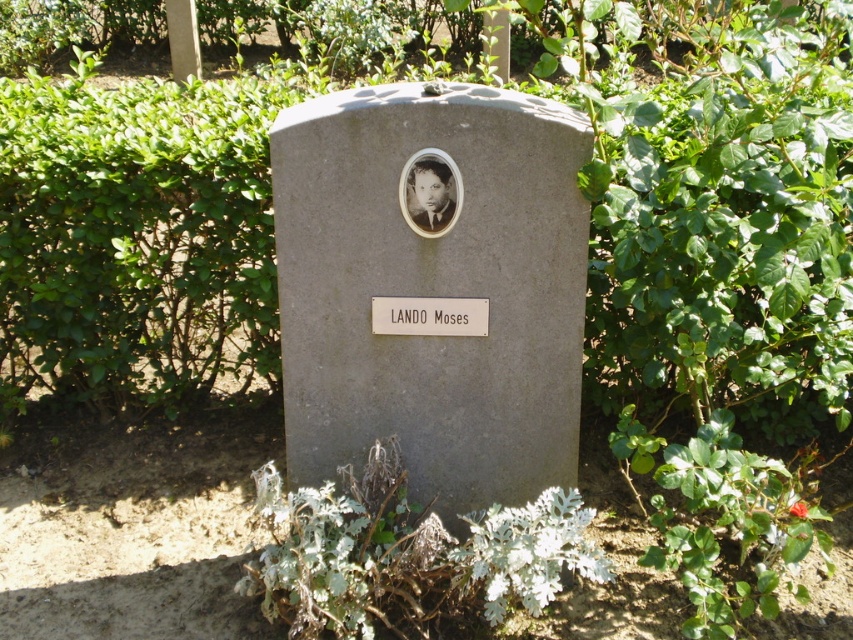
Question: Which of the following is the closest to the observer?

Choices:
 (A) gray stone gravestone at center
 (B) matte black face at center

Answer: (A)

Question: Which object is farther from the camera taking this photo?

Choices:
 (A) gray stone gravestone at center
 (B) matte black face at center

Answer: (B)

Question: Is gray stone gravestone at center positioned in front of matte black face at center?

Choices:
 (A) no
 (B) yes

Answer: (B)

Question: Does gray stone gravestone at center have a smaller size compared to matte black face at center?

Choices:
 (A) no
 (B) yes

Answer: (A)

Question: Does gray stone gravestone at center have a smaller size compared to matte black face at center?

Choices:
 (A) yes
 (B) no

Answer: (B)